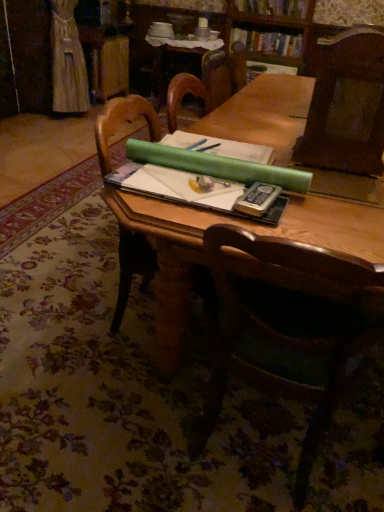
Identify the location of vacant space that is to the left of wooden table at center. The height and width of the screenshot is (512, 384). pos(70,314).